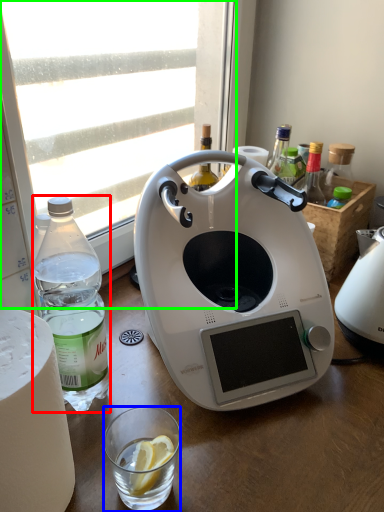
Question: Estimate the real-world distances between objects in this image. Which object is closer to bottle (highlighted by a red box), coffee cup (highlighted by a blue box) or window (highlighted by a green box)?

Choices:
 (A) coffee cup
 (B) window

Answer: (A)